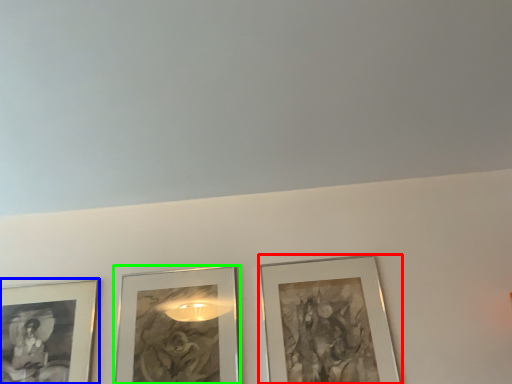
Question: Based on their relative distances, which object is nearer to picture frame (highlighted by a red box)? Choose from picture frame (highlighted by a blue box) and picture frame (highlighted by a green box).

Choices:
 (A) picture frame
 (B) picture frame

Answer: (B)